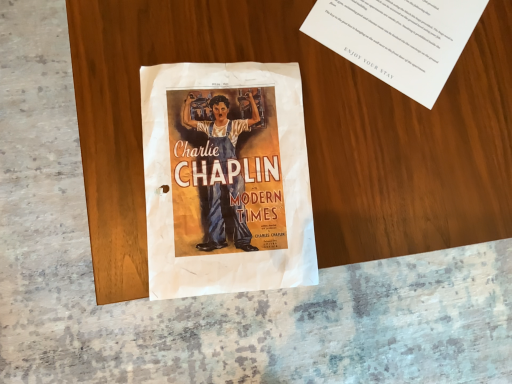
Locate an element on the screen. This screenshot has height=384, width=512. vacant area that is in front of white paper at upper right is located at coordinates (322, 124).